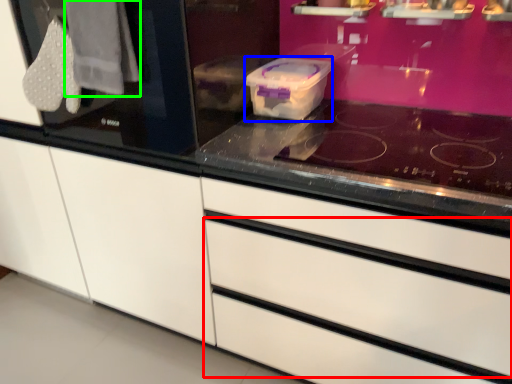
Question: Which object is positioned closest to drawer (highlighted by a red box)? Select from appliance (highlighted by a blue box) and clothe (highlighted by a green box).

Choices:
 (A) appliance
 (B) clothe

Answer: (A)